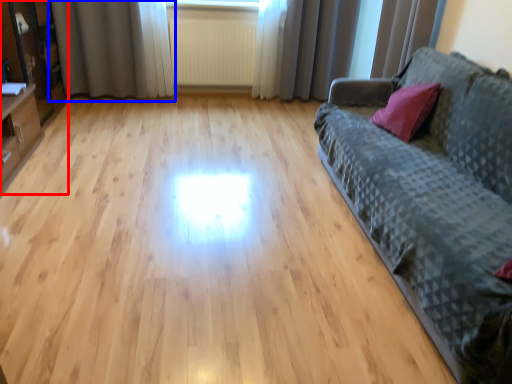
Question: Which point is closer to the camera, entertainment center (highlighted by a red box) or curtain (highlighted by a blue box)?

Choices:
 (A) entertainment center
 (B) curtain

Answer: (A)